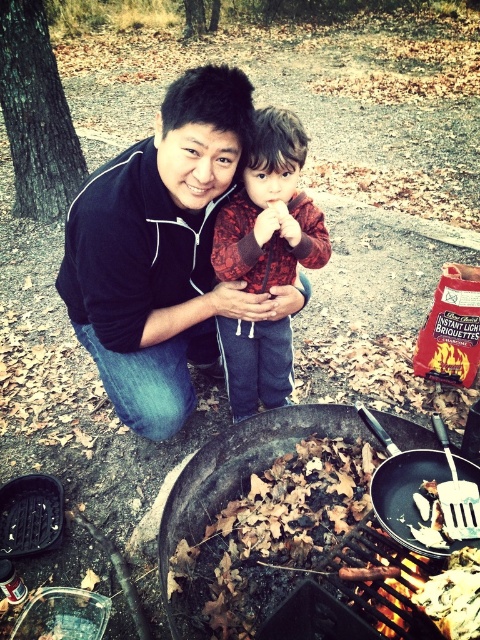
You are standing at the center of the image. Which object is located at the coordinates point (297, 524)?

The charcoal grill at center is located at point (297, 524).

You are a chef preparing a meal and need to place a black matte frying pan at lower center onto the charcoal grill at center. Can you do this based on their positions?

The charcoal grill at center is located below the black matte frying pan at lower center, so yes, you can place the black matte frying pan at lower center onto the charcoal grill at center since it is positioned above it.